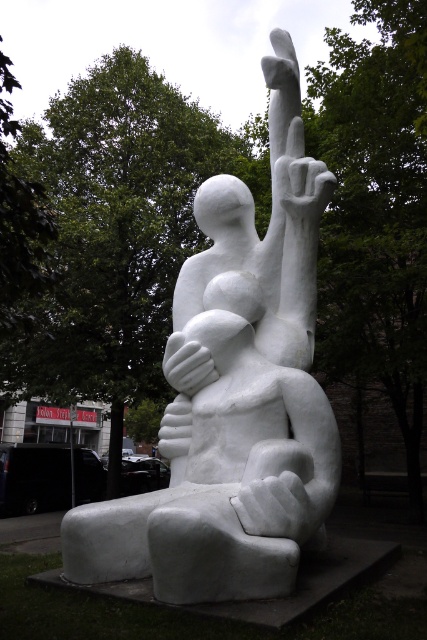
Question: Can you confirm if white matte hand at upper center is bigger than white matte hand at center?

Choices:
 (A) yes
 (B) no

Answer: (B)

Question: Which object is positioned farthest from the white stone sculpture at center?

Choices:
 (A) white matte hand at center
 (B) white matte hand at upper center

Answer: (A)

Question: Which of these objects is positioned farthest from the white matte hand at upper center?

Choices:
 (A) white stone sculpture at center
 (B) white matte hand at center

Answer: (B)

Question: Is white stone sculpture at center to the right of white matte hand at upper center from the viewer's perspective?

Choices:
 (A) yes
 (B) no

Answer: (B)

Question: Which of these objects is positioned closest to the white stone sculpture at center?

Choices:
 (A) white matte hand at center
 (B) white matte hand at upper center

Answer: (B)

Question: Is white matte hand at upper center closer to camera compared to white matte hand at center?

Choices:
 (A) no
 (B) yes

Answer: (A)